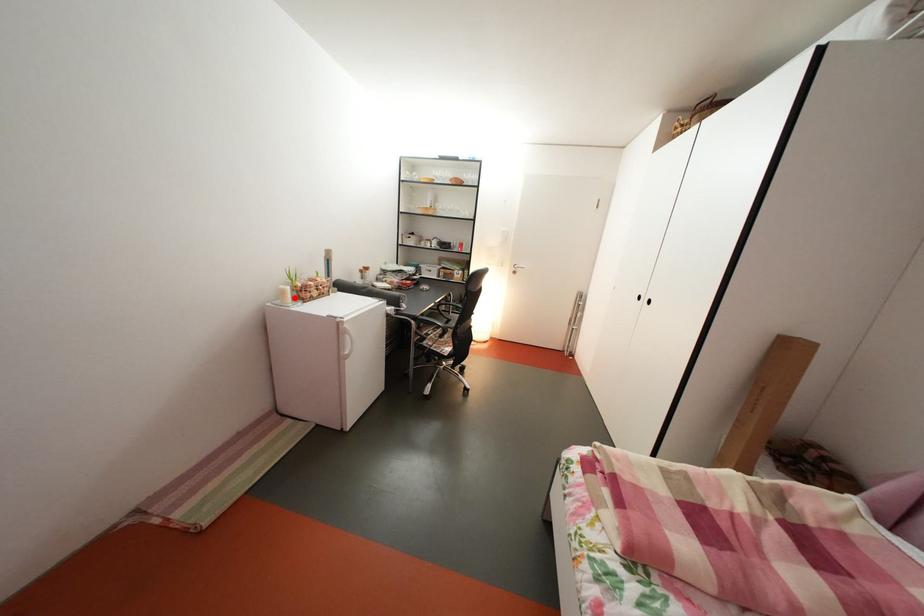
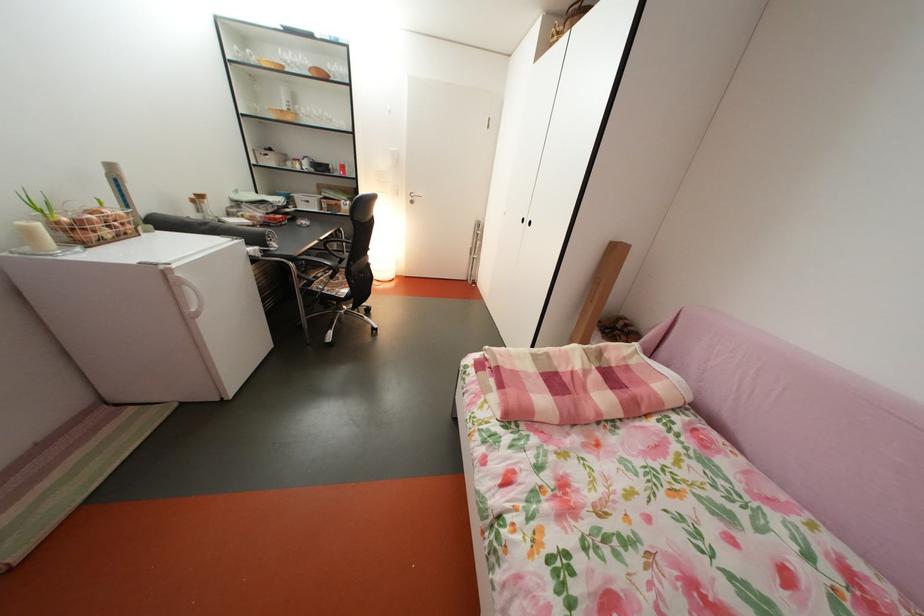
Question: I am providing you with two images of the same scene from different viewpoints. A red point is shown in image1. For the corresponding object point in image2, is it positioned nearer or farther from the camera?

Choices:
 (A) Nearer
 (B) Farther

Answer: (B)